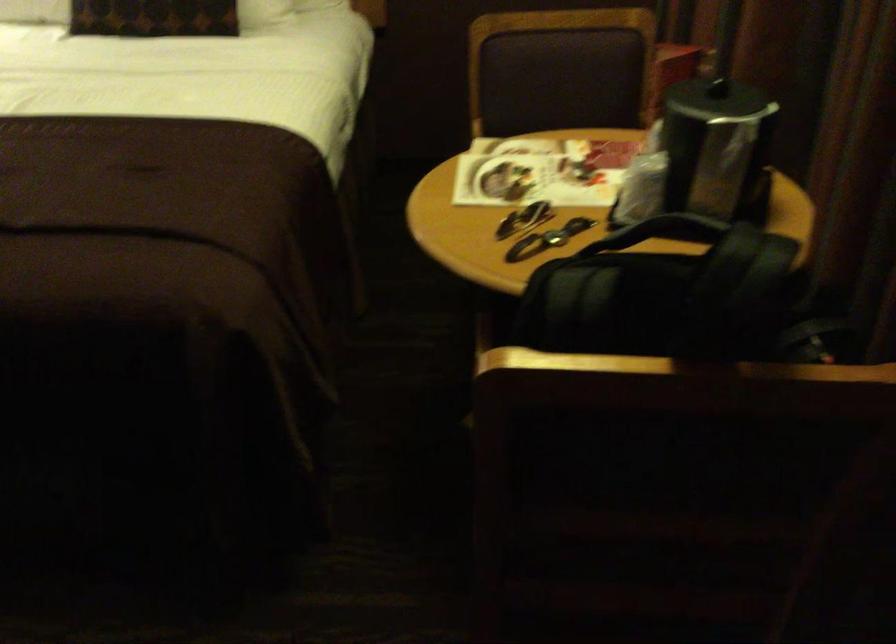
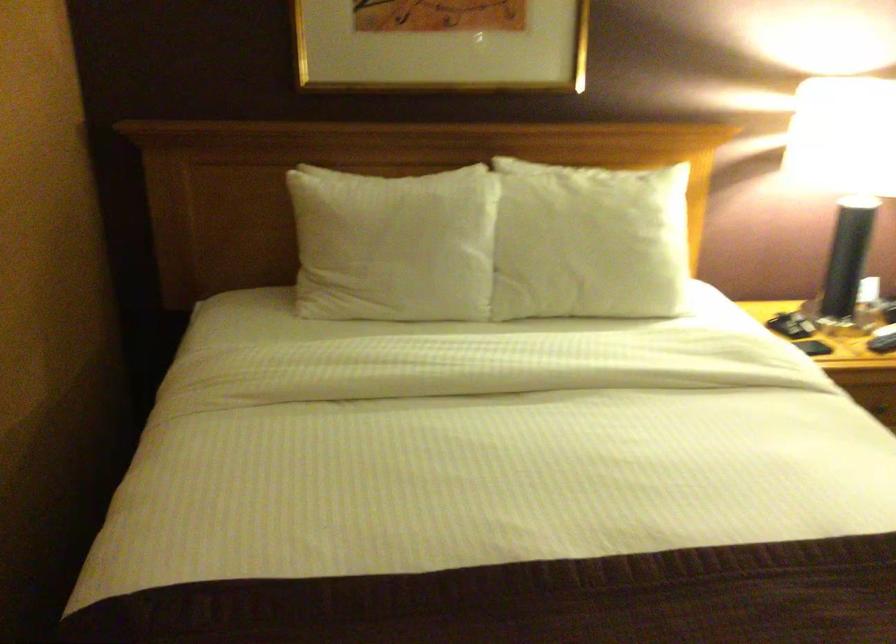
Question: Which direction would the cameraman need to move to produce the second image? Reply with the corresponding letter.

Choices:
 (A) Left
 (B) Right
 (C) Forward
 (D) Backward

Answer: (A)